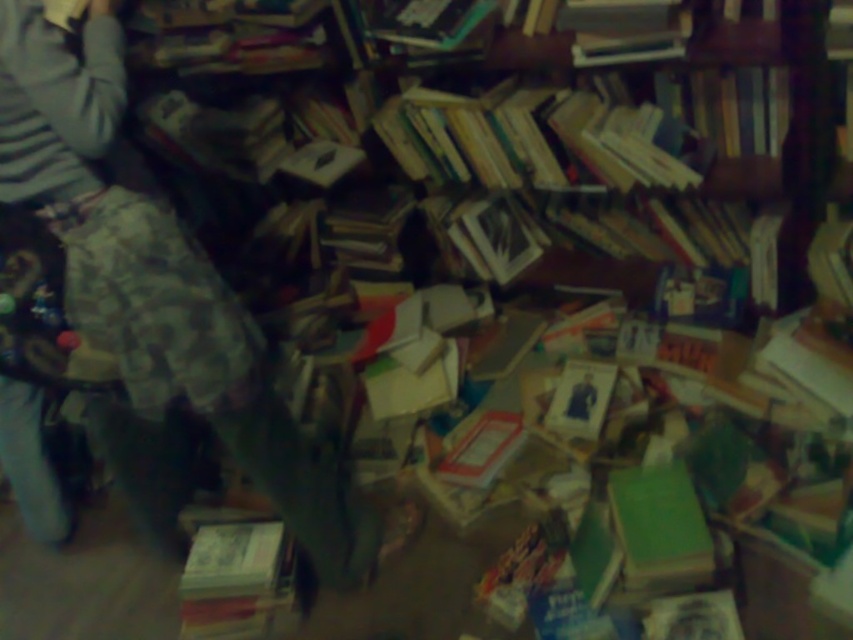
Which of these two, striped fabric at upper left or wooden bookcase at upper center, stands taller?

striped fabric at upper left

Does striped fabric at upper left lie in front of wooden bookcase at upper center?

Yes, striped fabric at upper left is closer to the viewer.

Where is `striped fabric at upper left`? This screenshot has width=853, height=640. striped fabric at upper left is located at coordinates [155, 280].

Can you confirm if striped fabric at upper left is positioned to the right of hardcover book at lower left?

Incorrect, striped fabric at upper left is not on the right side of hardcover book at lower left.

At what (x,y) coordinates should I click in order to perform the action: click on striped fabric at upper left. Please return your answer as a coordinate pair (x, y). This screenshot has width=853, height=640. Looking at the image, I should click on coord(155,280).

The image size is (853, 640). I want to click on striped fabric at upper left, so click(155, 280).

Is the position of wooden bookcase at upper center less distant than that of hardcover book at lower left?

No.

Does point (821, 54) come farther from viewer compared to point (254, 556)?

Yes, point (821, 54) is behind point (254, 556).

Find the location of a particular element. Image resolution: width=853 pixels, height=640 pixels. wooden bookcase at upper center is located at coordinates (743, 154).